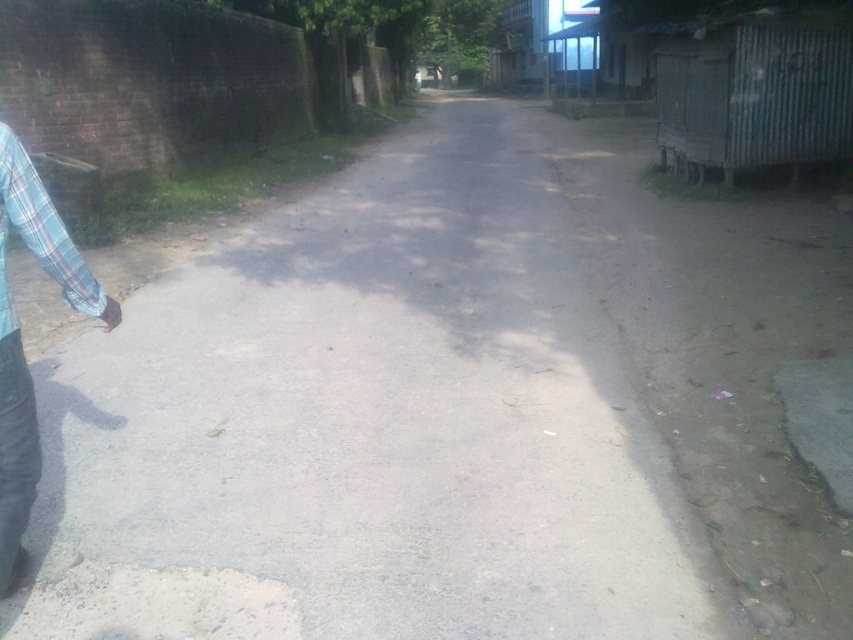
Question: Can you confirm if gray concrete pavement at center is positioned to the right of blue plaid shirt at left?

Choices:
 (A) yes
 (B) no

Answer: (A)

Question: Can you confirm if blue plaid shirt at left is positioned to the left of plaid fabric shirt at left?

Choices:
 (A) no
 (B) yes

Answer: (A)

Question: Which of the following is the closest to the observer?

Choices:
 (A) (204, 552)
 (B) (56, 243)

Answer: (B)

Question: Is gray concrete pavement at center above blue plaid shirt at left?

Choices:
 (A) yes
 (B) no

Answer: (A)

Question: Among these objects, which one is farthest from the camera?

Choices:
 (A) plaid fabric shirt at left
 (B) blue plaid shirt at left

Answer: (A)

Question: Which object is positioned farthest from the gray concrete pavement at center?

Choices:
 (A) blue plaid shirt at left
 (B) plaid fabric shirt at left

Answer: (B)